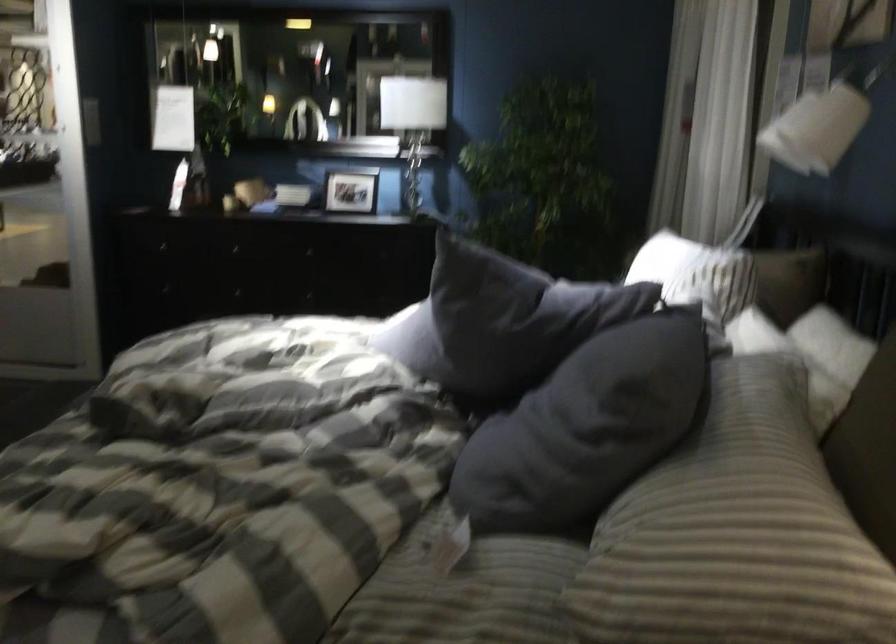
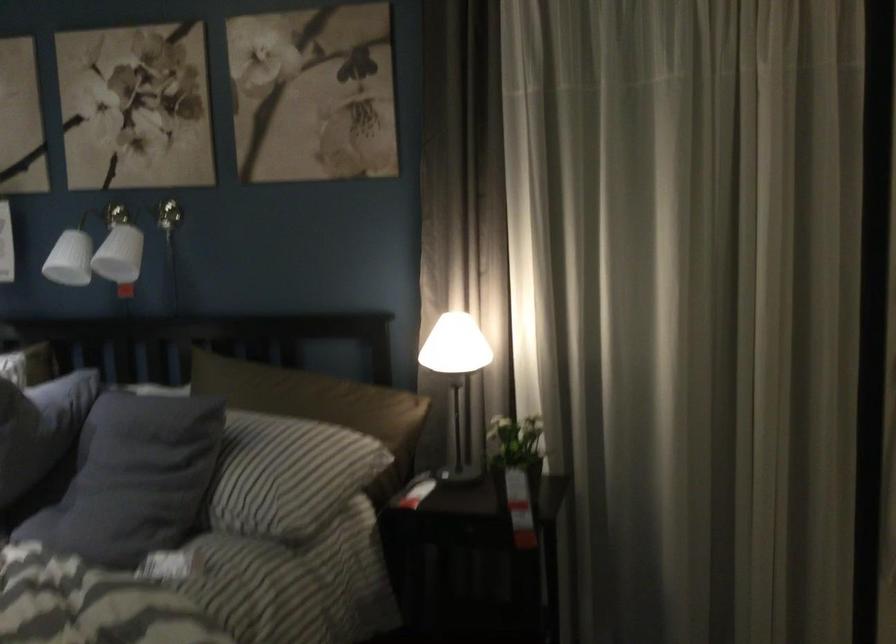
The point at (679, 520) is marked in the first image. Where is the corresponding point in the second image?

(280, 471)